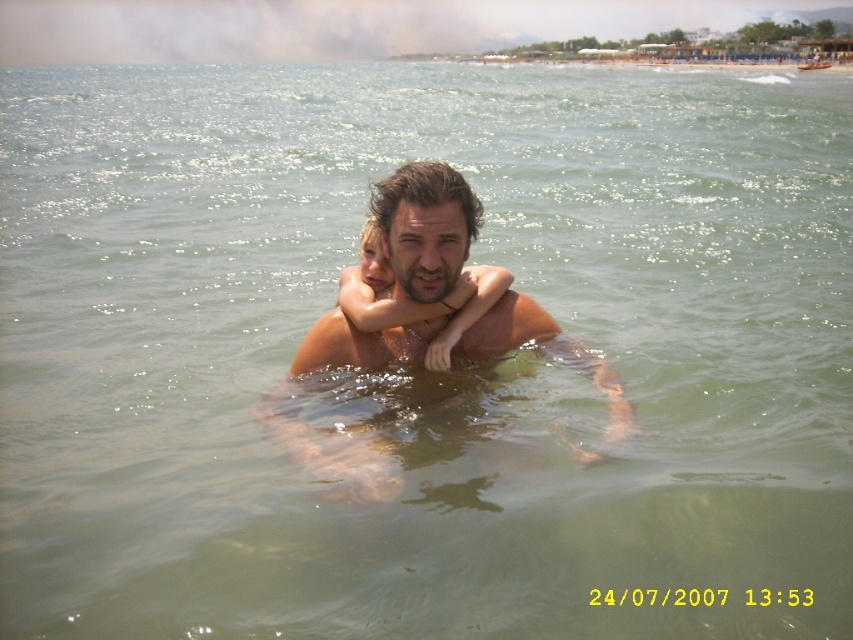
Question: Is smooth skin man at center to the left of smooth skin child at center from the viewer's perspective?

Choices:
 (A) no
 (B) yes

Answer: (A)

Question: Does smooth skin man at center have a greater width compared to smooth skin child at center?

Choices:
 (A) no
 (B) yes

Answer: (B)

Question: Which of the following is the closest to the observer?

Choices:
 (A) smooth skin man at center
 (B) smooth skin child at center

Answer: (A)

Question: Can you confirm if smooth skin man at center is positioned to the left of smooth skin child at center?

Choices:
 (A) no
 (B) yes

Answer: (A)